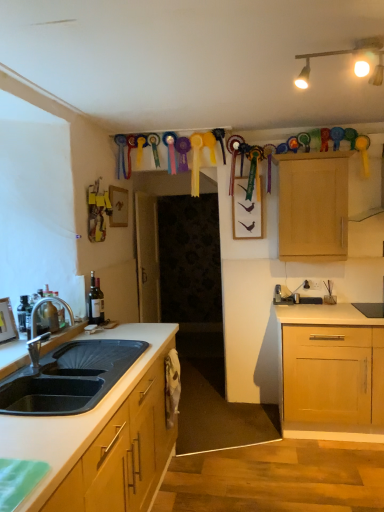
Question: Considering the positions of brushed metal faucet at sink left and light wood cabinet at upper right in the image, is brushed metal faucet at sink left wider or thinner than light wood cabinet at upper right?

Choices:
 (A) thin
 (B) wide

Answer: (A)

Question: In the image, is brushed metal faucet at sink left positioned in front of or behind light wood cabinet at upper right?

Choices:
 (A) behind
 (B) front

Answer: (B)

Question: Which object is the farthest from the wooden picture frame at left?

Choices:
 (A) light wood cabinet at upper right
 (B) matte gold track lights at upper center
 (C) brushed metal faucet at sink left

Answer: (A)

Question: Estimate the real-world distances between objects in this image. Which object is farther from the light wood cabinet at upper right?

Choices:
 (A) matte gold track lights at upper center
 (B) wooden picture frame at left
 (C) brushed metal faucet at sink left

Answer: (B)